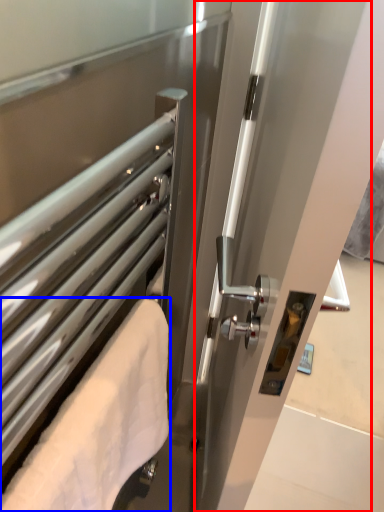
Question: Which of the following is the closest to the observer, screen door (highlighted by a red box) or towel (highlighted by a blue box)?

Choices:
 (A) screen door
 (B) towel

Answer: (A)